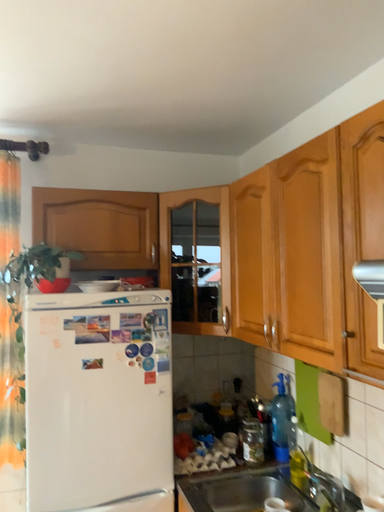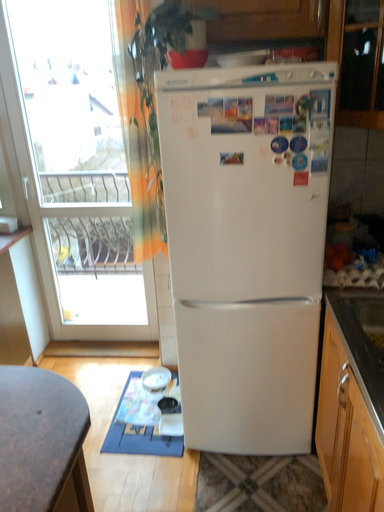
Question: How did the camera likely rotate when shooting the video?

Choices:
 (A) rotated upward
 (B) rotated downward

Answer: (B)